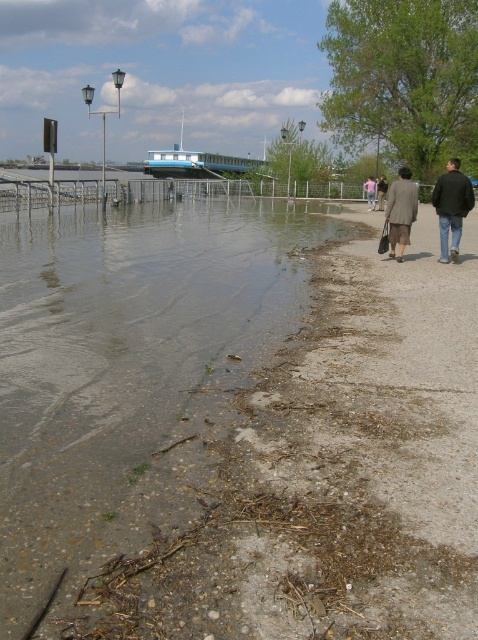
You are a hiker who has just arrived at the flooded waterfront area. You see a dark blue jacket at right and a matte gray coat at center. Which clothing item is bigger in size?

The dark blue jacket at right is larger in size compared to the matte gray coat at center.